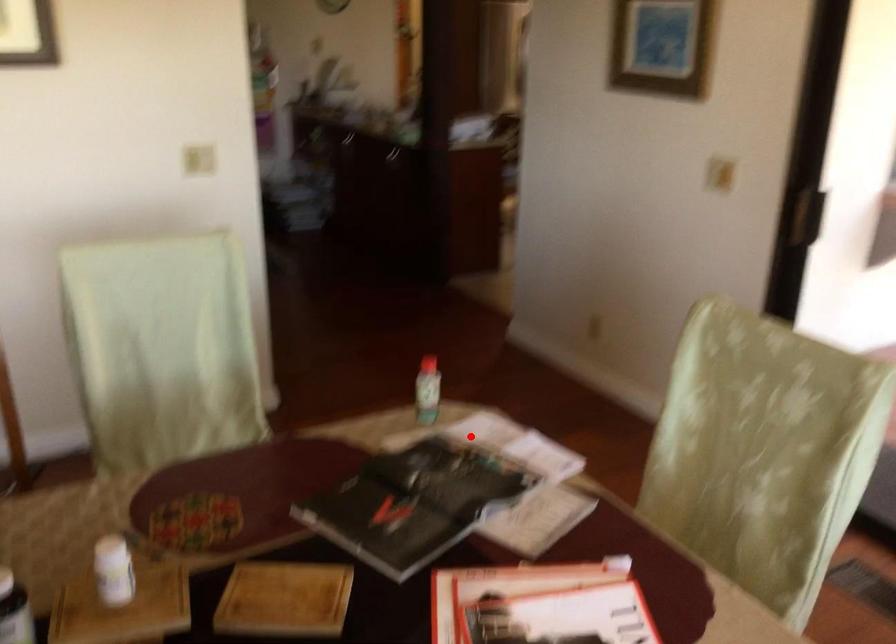
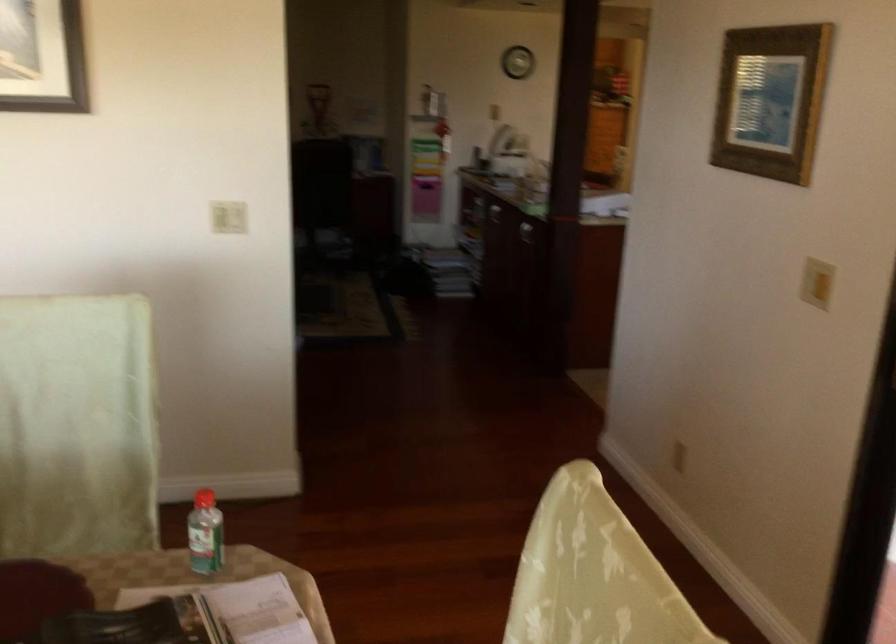
Question: I am providing you with two images of the same scene from different viewpoints. A red point is shown in image1. For the corresponding object point in image2, is it positioned nearer or farther from the camera?

Choices:
 (A) Nearer
 (B) Farther

Answer: (A)